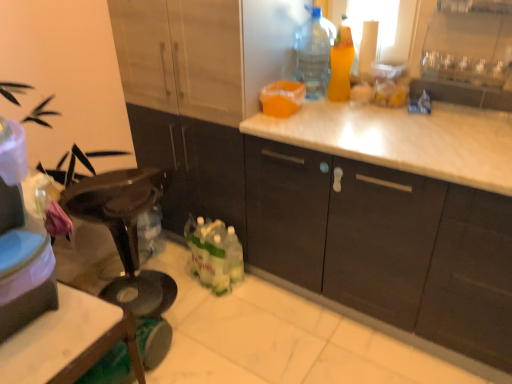
The image size is (512, 384). I want to click on free space in front of transparent plastic bottle at upper right, the 1th bottle from the left, so click(319, 104).